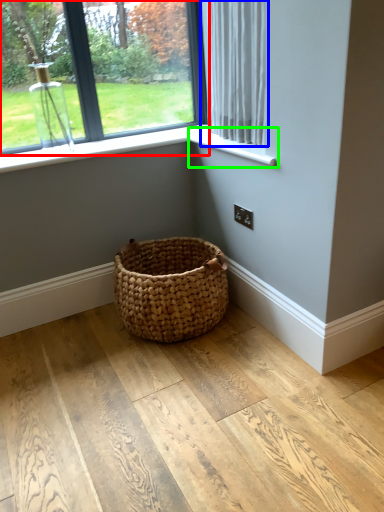
Question: Which object is the farthest from window (highlighted by a red box)? Choose among these: curtain (highlighted by a blue box) or window sill (highlighted by a green box).

Choices:
 (A) curtain
 (B) window sill

Answer: (B)